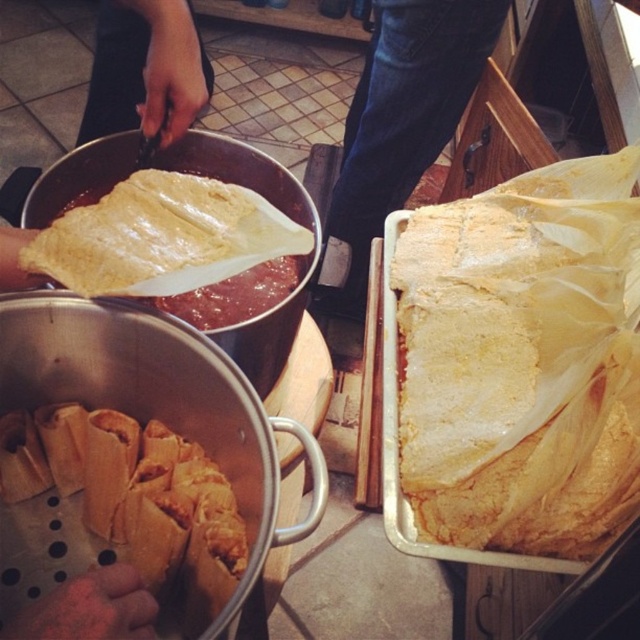
Does yellow paper wrapper at center have a larger size compared to yellowish matte corn tortilla at upper left?

Correct, yellow paper wrapper at center is larger in size than yellowish matte corn tortilla at upper left.

Does yellow paper wrapper at center come in front of yellowish matte corn tortilla at upper left?

No, yellow paper wrapper at center is behind yellowish matte corn tortilla at upper left.

Does point (484, 292) come in front of point (202, 273)?

No.

You are a GUI agent. You are given a task and a screenshot of the screen. Output one action in this format:
    pyautogui.click(x=<x>, y=<y>)
    Task: Click on the yellow paper wrapper at center
    This screenshot has height=640, width=640.
    Given the screenshot: What is the action you would take?
    pyautogui.click(x=515, y=369)

Does yellow paper wrapper at center have a larger size compared to golden brown dough at lower left?

Indeed, yellow paper wrapper at center has a larger size compared to golden brown dough at lower left.

Who is more distant from viewer, (513, 305) or (125, 552)?

The point (513, 305) is behind.

At what (x,y) coordinates should I click in order to perform the action: click on yellow paper wrapper at center. Please return your answer as a coordinate pair (x, y). The width and height of the screenshot is (640, 640). Looking at the image, I should click on (515, 369).

Is golden brown dough at lower left taller than yellowish matte corn tortilla at upper left?

Indeed, golden brown dough at lower left has a greater height compared to yellowish matte corn tortilla at upper left.

Does golden brown dough at lower left appear over yellowish matte corn tortilla at upper left?

No.

This screenshot has width=640, height=640. Describe the element at coordinates (134, 499) in the screenshot. I see `golden brown dough at lower left` at that location.

Where is `golden brown dough at lower left`? The image size is (640, 640). golden brown dough at lower left is located at coordinates (134, 499).